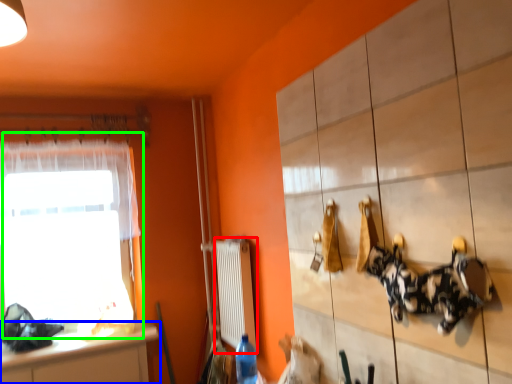
Question: Which is nearer to the radiator (highlighted by a red box)? countertop (highlighted by a blue box) or window (highlighted by a green box).

Choices:
 (A) countertop
 (B) window

Answer: (A)